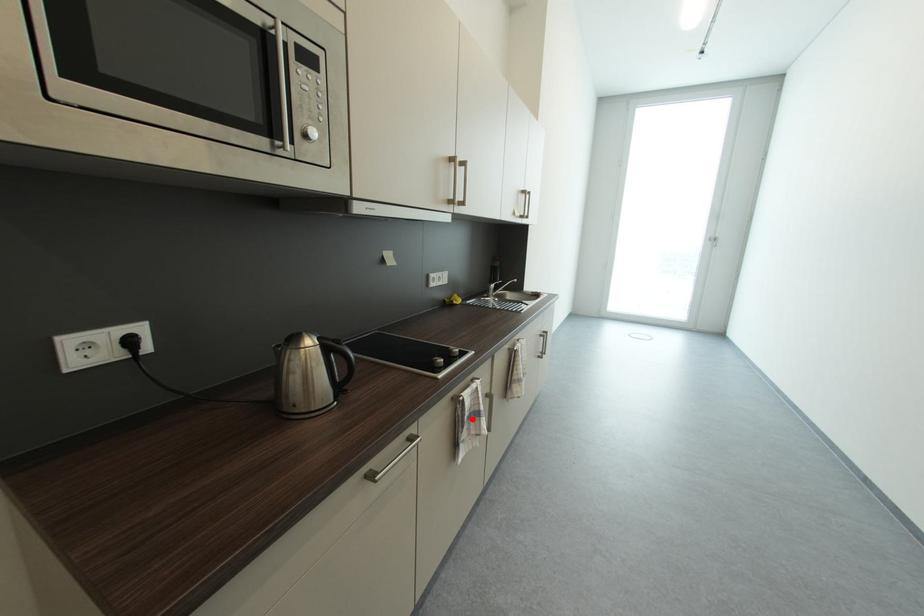
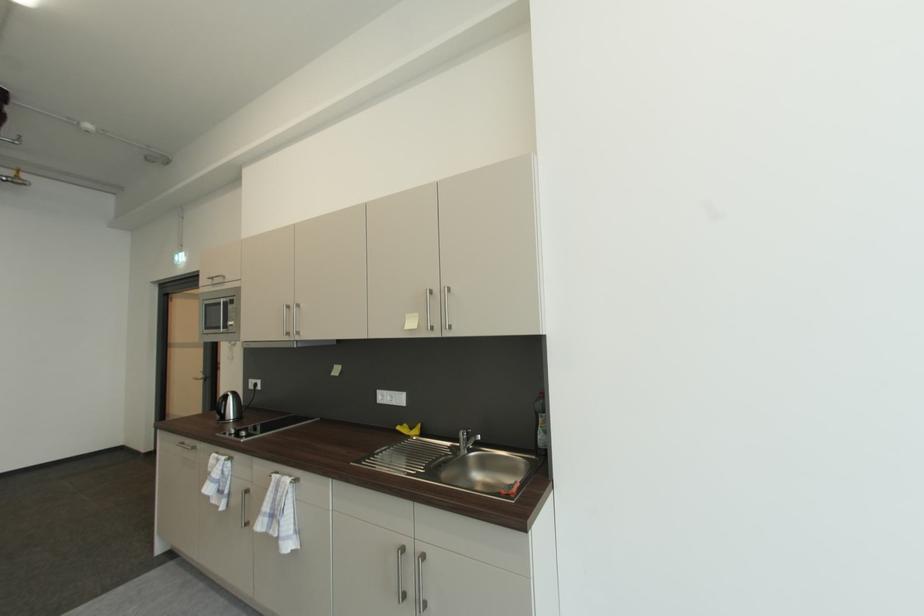
Where in the second image is the point corresponding to the highlighted location from the first image?

(215, 471)